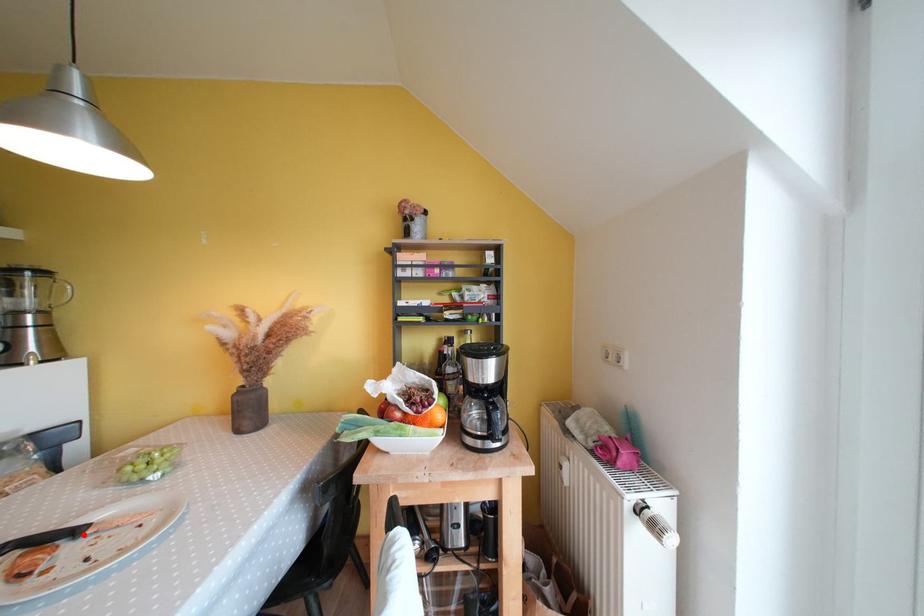
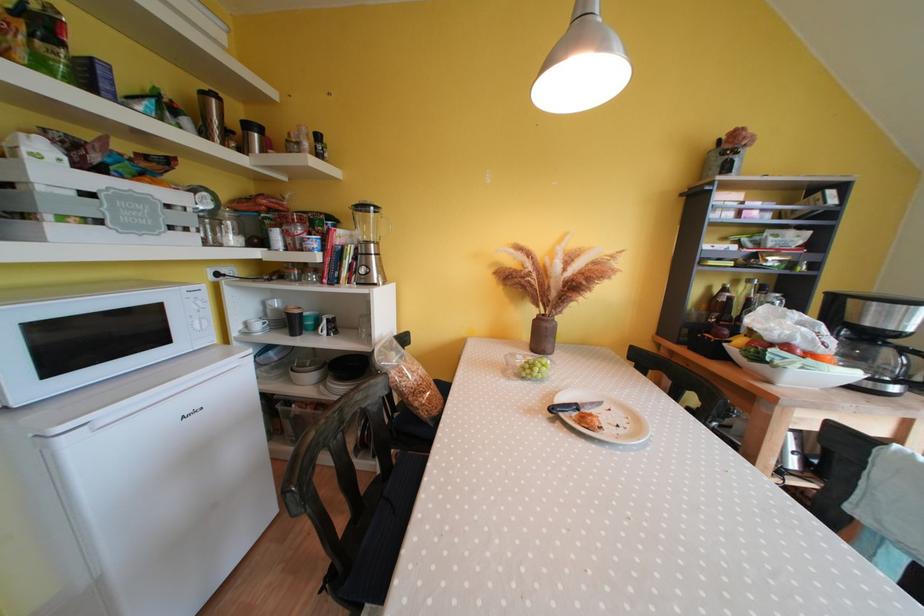
Locate, in the second image, the point that corresponds to the highlighted location in the first image.

(582, 410)